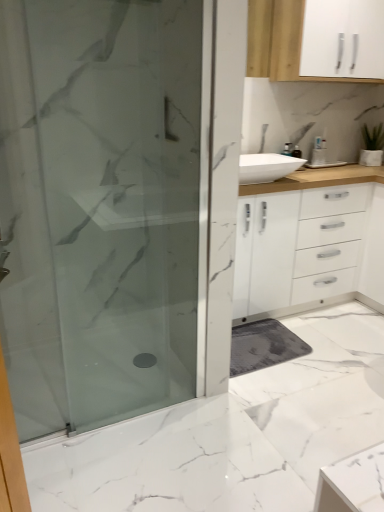
The image size is (384, 512). I want to click on vacant space situated on the left part of frosted glass shower door at left, so (x=64, y=409).